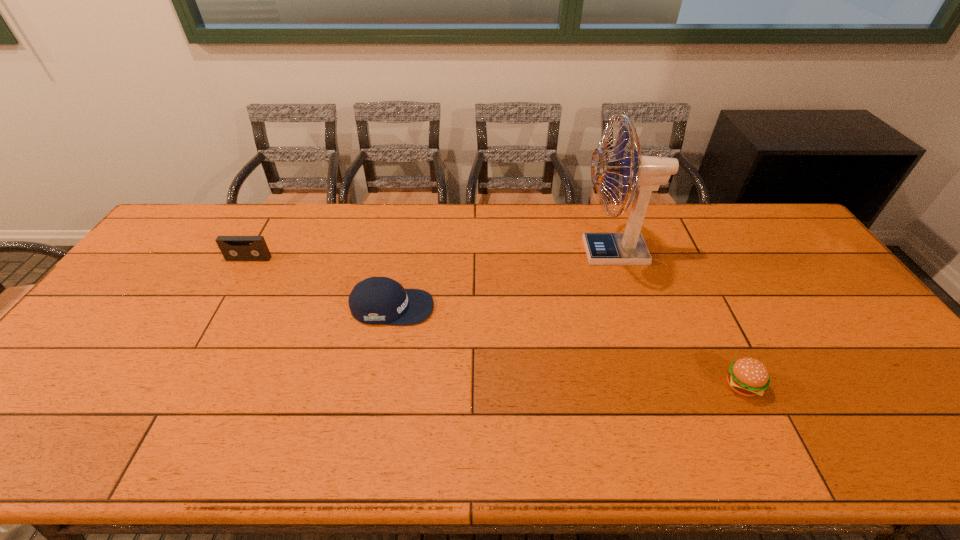
Locate an element on the screen. The image size is (960, 540). free space between the hamburger and the second nearest object is located at coordinates (566, 347).

Where is `unoccupied area between the leftmost object and the fan`? The height and width of the screenshot is (540, 960). unoccupied area between the leftmost object and the fan is located at coordinates (431, 255).

This screenshot has height=540, width=960. Find the location of `free space between the fan and the hamburger`. free space between the fan and the hamburger is located at coordinates (677, 319).

I want to click on empty space that is in between the rightmost object and the third object from right to left, so click(566, 347).

Identify the location of unoccupied position between the leftmost object and the fan. (431, 255).

I want to click on vacant space that's between the third object from left to right and the videotape, so click(x=431, y=255).

Find the location of a particular element. This screenshot has width=960, height=540. empty location between the baseball cap and the nearest object is located at coordinates (566, 347).

The height and width of the screenshot is (540, 960). I want to click on free area in between the second nearest object and the videotape, so click(x=321, y=283).

Identify which object is the third closest to the tallest object. Please provide its 2D coordinates. Your answer should be formatted as a tuple, i.e. [(x, y)], where the tuple contains the x and y coordinates of a point satisfying the conditions above.

[(233, 248)]

In order to click on object that is the third nearest to the second object from right to left in this screenshot , I will do `click(233, 248)`.